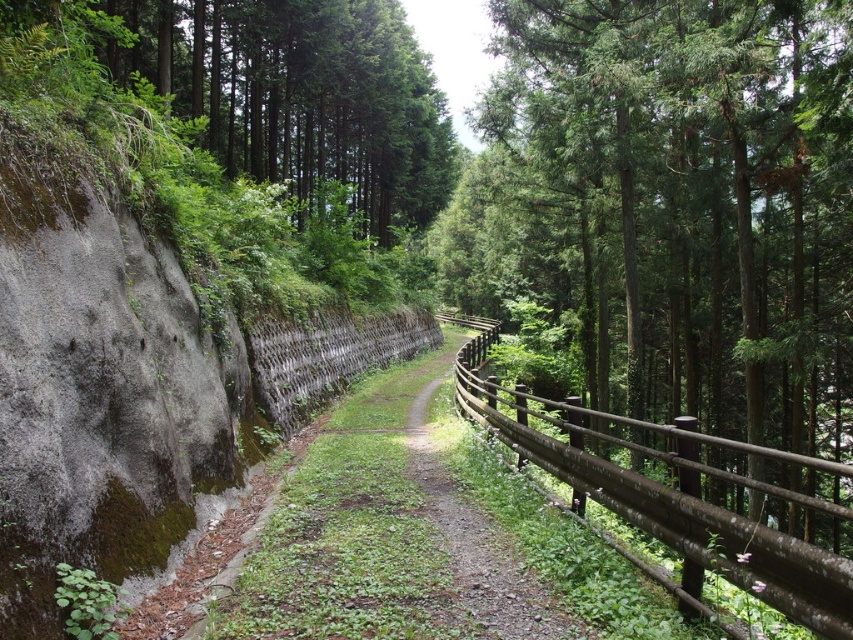
From the picture: Which of these two, brown wooden fence at right or wooden fence at center, stands taller?

Standing taller between the two is brown wooden fence at right.

The width and height of the screenshot is (853, 640). What are the coordinates of `brown wooden fence at right` in the screenshot? It's located at 670,509.

Between green textured fence at right and brown wooden trail at center, which one appears on the left side from the viewer's perspective?

brown wooden trail at center

Does green textured fence at right appear under brown wooden trail at center?

No.

Where is `green textured fence at right`? green textured fence at right is located at coordinates (694, 195).

Can you confirm if green textured fence at right is positioned to the left of brown wooden fence at right?

No, green textured fence at right is not to the left of brown wooden fence at right.

Which is behind, point (753, 17) or point (792, 611)?

Positioned behind is point (753, 17).

Who is more distant from viewer, (x=775, y=340) or (x=709, y=524)?

Point (x=775, y=340)

Identify the location of green textured fence at right. This screenshot has height=640, width=853. (694, 195).